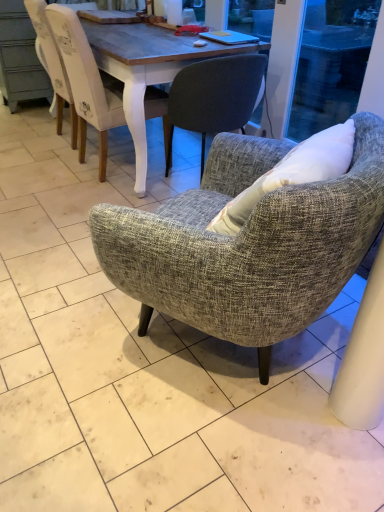
Question: From the image's perspective, is textured gray armchair at center, the 3th chair when ordered from back to front, located above white painted wood chair at upper left, the 3th chair in the front-to-back sequence?

Choices:
 (A) yes
 (B) no

Answer: (B)

Question: Is textured gray armchair at center, the 3th chair when ordered from back to front, bigger than white painted wood chair at upper left, which is the first chair in back-to-front order?

Choices:
 (A) yes
 (B) no

Answer: (B)

Question: Is textured gray armchair at center, the first chair in the front-to-back sequence, positioned in front of white painted wood chair at upper left, the 3th chair in the front-to-back sequence?

Choices:
 (A) no
 (B) yes

Answer: (B)

Question: Could white painted wood chair at upper left, which is the first chair in back-to-front order, be considered to be inside textured gray armchair at center, the 3th chair when ordered from back to front?

Choices:
 (A) yes
 (B) no

Answer: (B)

Question: Would you say textured gray armchair at center, the first chair in the front-to-back sequence, is outside white painted wood chair at upper left, the 3th chair in the front-to-back sequence?

Choices:
 (A) yes
 (B) no

Answer: (A)

Question: Is textured gray armchair at center, the first chair in the front-to-back sequence, in front of or behind white painted wood chair at upper left, the 3th chair in the front-to-back sequence, in the image?

Choices:
 (A) front
 (B) behind

Answer: (A)

Question: From the image's perspective, is textured gray armchair at center, the 3th chair when ordered from back to front, positioned above or below white painted wood chair at upper left, which is the first chair in back-to-front order?

Choices:
 (A) below
 (B) above

Answer: (A)

Question: Considering the positions of point (228, 331) and point (92, 100), is point (228, 331) closer or farther from the camera than point (92, 100)?

Choices:
 (A) closer
 (B) farther

Answer: (A)

Question: Is textured gray armchair at center, the 3th chair when ordered from back to front, wider or thinner than white painted wood chair at upper left, the 3th chair in the front-to-back sequence?

Choices:
 (A) wide
 (B) thin

Answer: (B)

Question: Is point click(x=193, y=113) closer or farther from the camera than point click(x=66, y=53)?

Choices:
 (A) farther
 (B) closer

Answer: (B)

Question: Is textured gray armchair at center, the 2th chair when ordered from back to front, bigger or smaller than white painted wood chair at upper left, the 3th chair in the front-to-back sequence?

Choices:
 (A) big
 (B) small

Answer: (B)

Question: In terms of height, does textured gray armchair at center, the 2th chair when ordered from back to front, look taller or shorter compared to white painted wood chair at upper left, the 3th chair in the front-to-back sequence?

Choices:
 (A) tall
 (B) short

Answer: (B)

Question: From the image's perspective, is textured gray armchair at center, the 2th chair when ordered from back to front, above or below white painted wood chair at upper left, which is the first chair in back-to-front order?

Choices:
 (A) below
 (B) above

Answer: (A)

Question: Looking at their shapes, would you say white painted wood chair at upper left, which is the first chair in back-to-front order, is wider or thinner than textured gray armchair at center, the first chair in the front-to-back sequence?

Choices:
 (A) wide
 (B) thin

Answer: (A)

Question: Do you think white painted wood chair at upper left, which is the first chair in back-to-front order, is within textured gray armchair at center, the first chair in the front-to-back sequence, or outside of it?

Choices:
 (A) outside
 (B) inside

Answer: (A)